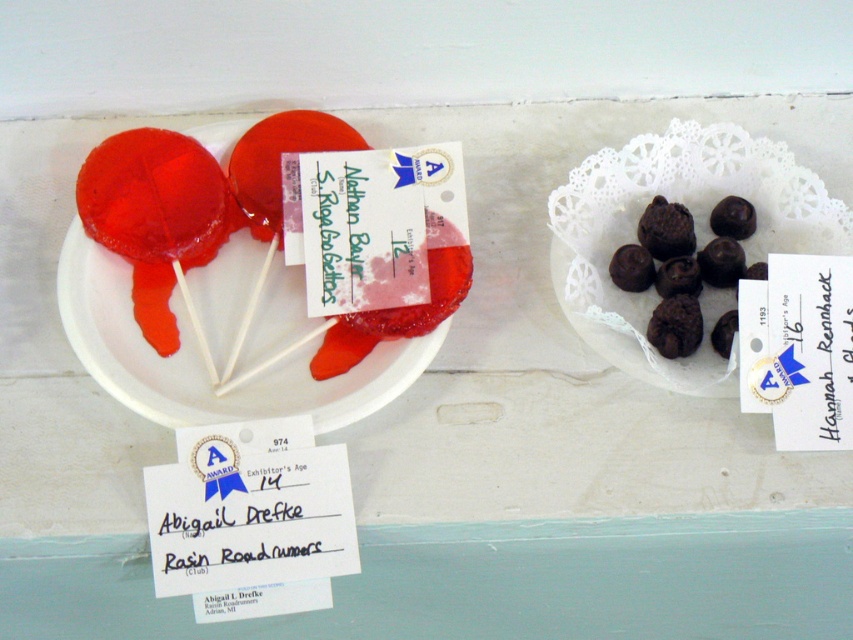
Is point (428, 355) positioned behind point (672, 342)?

Yes, point (428, 355) is farther from viewer.

Who is shorter, translucent gelatin at center or chocolate matte truffles at center?

chocolate matte truffles at center

The height and width of the screenshot is (640, 853). Find the location of `translucent gelatin at center`. translucent gelatin at center is located at coordinates (221, 340).

Does translucent gelatin at center come behind chocolate truffles at center?

That is False.

Does point (113, 346) lie in front of point (735, 164)?

Yes, it is.

Where is `translucent gelatin at center`? translucent gelatin at center is located at coordinates point(221,340).

Is chocolate truffles at center below chocolate matte truffles at center?

No.

Does chocolate truffles at center have a larger size compared to chocolate matte truffles at center?

Yes.

Which is in front, point (758, 212) or point (660, 208)?

Positioned in front is point (660, 208).

Locate an element on the screen. This screenshot has height=640, width=853. chocolate truffles at center is located at coordinates (694, 232).